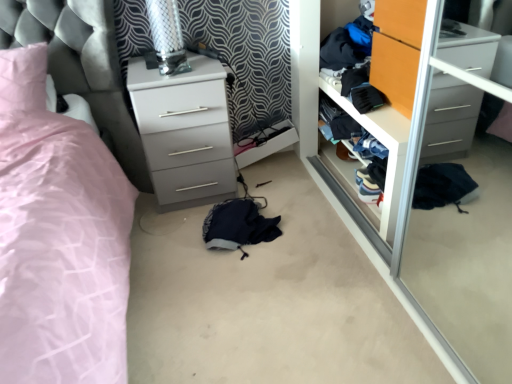
Find the location of a particular element. vacant space behind navy blue fabric at center is located at coordinates (264, 188).